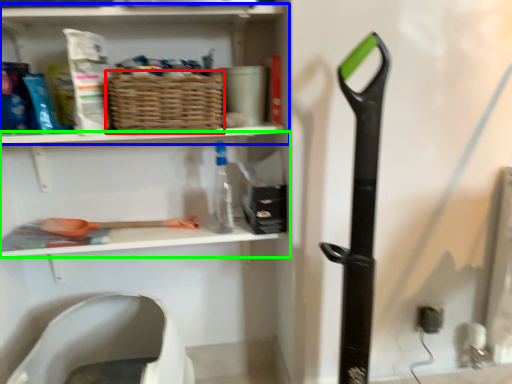
Question: Estimate the real-world distances between objects in this image. Which object is farther from basket (highlighted by a red box), shelf (highlighted by a blue box) or shelf (highlighted by a green box)?

Choices:
 (A) shelf
 (B) shelf

Answer: (B)